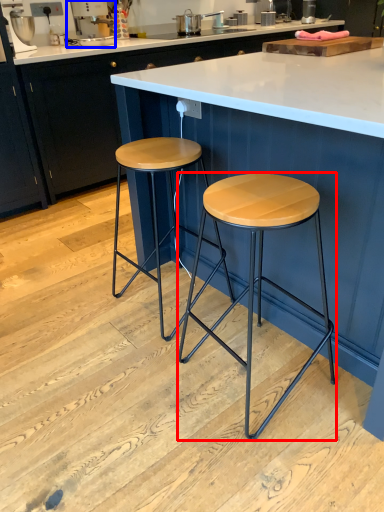
Question: Which of the following is the closest to the observer, stool (highlighted by a red box) or appliance (highlighted by a blue box)?

Choices:
 (A) stool
 (B) appliance

Answer: (A)